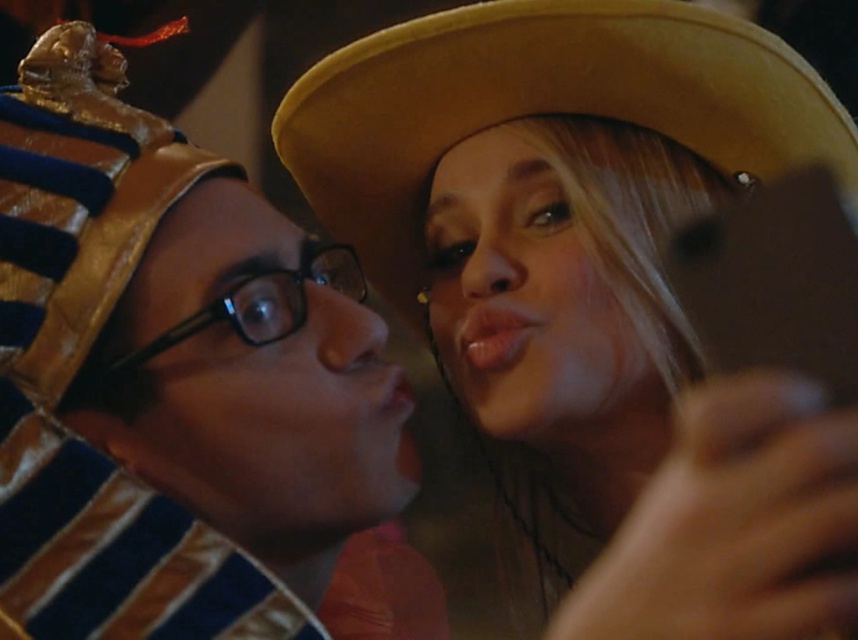
Question: Which object appears farthest from the camera in this image?

Choices:
 (A) black plastic glasses at center
 (B) light brown felt cowboy hat at upper center

Answer: (B)

Question: In this image, where is light brown felt cowboy hat at upper center located relative to black plastic glasses at center?

Choices:
 (A) right
 (B) left

Answer: (A)

Question: Which point is farther from the camera taking this photo?

Choices:
 (A) (330, 124)
 (B) (315, 243)

Answer: (A)

Question: Can you confirm if light brown felt cowboy hat at upper center is smaller than black plastic glasses at center?

Choices:
 (A) no
 (B) yes

Answer: (A)

Question: Can you confirm if light brown felt cowboy hat at upper center is bigger than black plastic glasses at center?

Choices:
 (A) yes
 (B) no

Answer: (A)